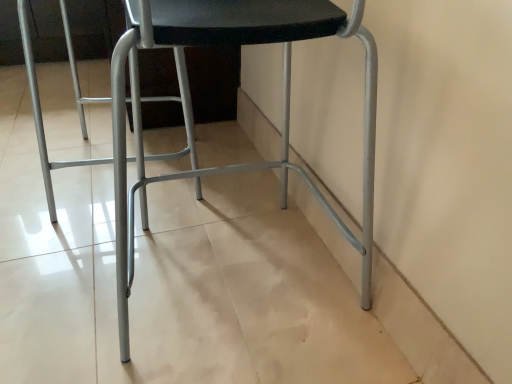
This screenshot has width=512, height=384. Identify the location of vacant space underneath metallic gray chair at center (from a real-world perspective). point(225,286).